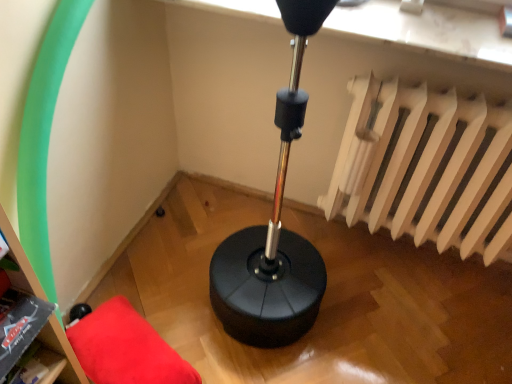
Question: In terms of size, does white matte radiator at upper right appear bigger or smaller than red fabric cushion at lower left?

Choices:
 (A) big
 (B) small

Answer: (A)

Question: Considering the positions of white matte radiator at upper right and red fabric cushion at lower left in the image, is white matte radiator at upper right wider or thinner than red fabric cushion at lower left?

Choices:
 (A) wide
 (B) thin

Answer: (B)

Question: Estimate the real-world distances between objects in this image. Which object is closer to the white matte radiator at upper right?

Choices:
 (A) red fabric cushion at lower left
 (B) matte black bookshelf at lower left

Answer: (A)

Question: Based on their relative distances, which object is nearer to the red fabric cushion at lower left?

Choices:
 (A) white matte radiator at upper right
 (B) matte black bookshelf at lower left

Answer: (B)